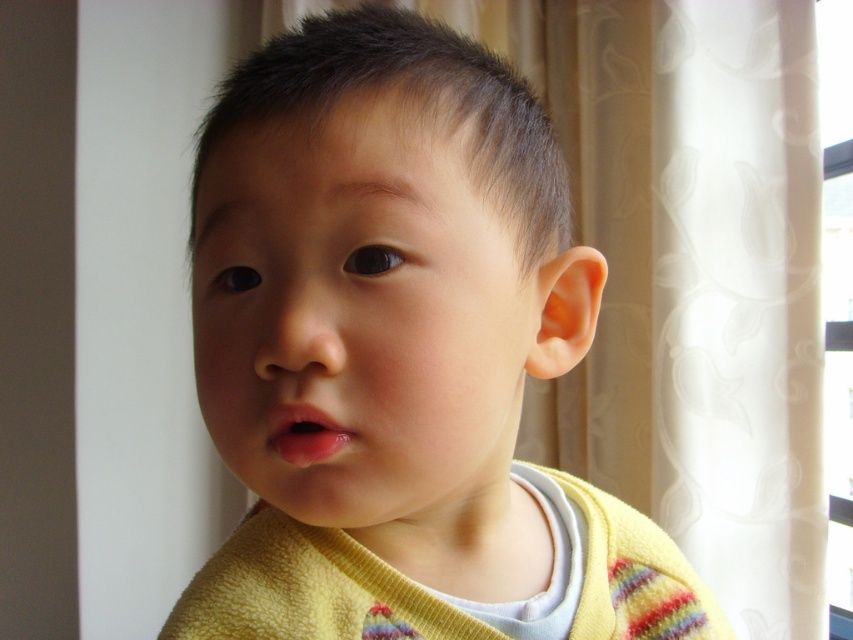
Question: Does yellow soft sweater at center appear under transparent plastic window at upper right?

Choices:
 (A) yes
 (B) no

Answer: (A)

Question: Which of the following is the farthest from the observer?

Choices:
 (A) transparent plastic window at upper right
 (B) yellow soft sweater at center

Answer: (A)

Question: Considering the real-world distances, which object is closest to the smooth skin face at center?

Choices:
 (A) transparent plastic window at upper right
 (B) yellow soft sweater at center

Answer: (B)

Question: Is smooth skin face at center smaller than transparent plastic window at upper right?

Choices:
 (A) yes
 (B) no

Answer: (A)

Question: Which object is closer to the camera taking this photo?

Choices:
 (A) smooth skin face at center
 (B) transparent plastic window at upper right

Answer: (A)

Question: Does yellow soft sweater at center appear under transparent plastic window at upper right?

Choices:
 (A) yes
 (B) no

Answer: (A)